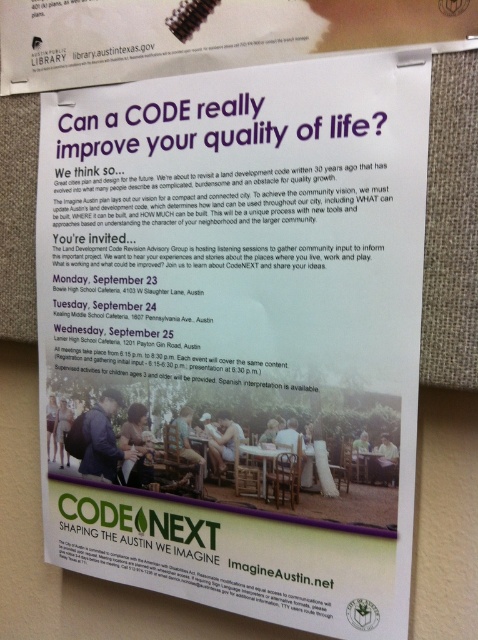
What are the coordinates of the white paper at upper center on the poster?

The white paper at upper center is located at coordinates point [206,35].